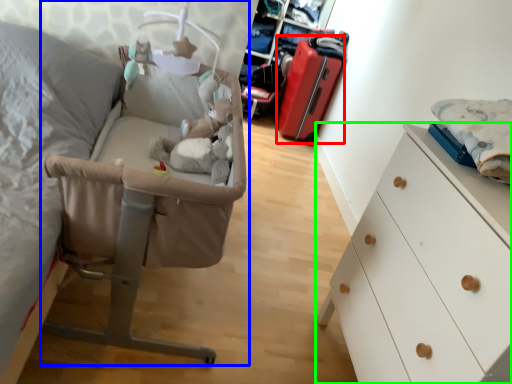
Question: Considering the real-world distances, which object is farthest from luggage (highlighted by a red box)? infant bed (highlighted by a blue box) or chest of drawers (highlighted by a green box)?

Choices:
 (A) infant bed
 (B) chest of drawers

Answer: (B)